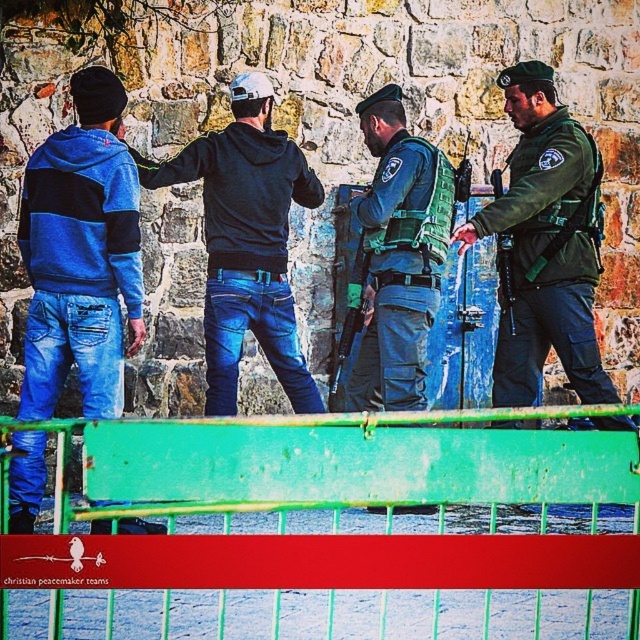
Question: Which object is farther from the camera taking this photo?

Choices:
 (A) dark blue hoodie at center
 (B) blue striped hoodie at left

Answer: (A)

Question: Is green painted metal barricade at center below green uniformed officer at center?

Choices:
 (A) yes
 (B) no

Answer: (A)

Question: Is dark blue hoodie at center thinner than green uniformed police at center?

Choices:
 (A) no
 (B) yes

Answer: (A)

Question: Can you confirm if green uniformed officer at center is wider than green uniformed police at center?

Choices:
 (A) no
 (B) yes

Answer: (B)

Question: Which object appears closest to the camera in this image?

Choices:
 (A) green uniformed officer at center
 (B) green uniformed police at center
 (C) green painted metal barricade at center

Answer: (C)

Question: Which object is farther from the camera taking this photo?

Choices:
 (A) blue striped hoodie at left
 (B) green painted metal barricade at center
 (C) green uniformed officer at center

Answer: (C)